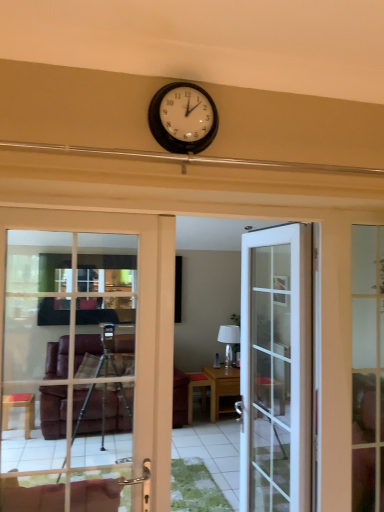
Question: From a real-world perspective, is wooden table at center, which appears as the first table when viewed from the left, located beneath white glossy lamp at center?

Choices:
 (A) yes
 (B) no

Answer: (A)

Question: Can you confirm if wooden table at center, which appears as the first table when viewed from the left, is smaller than white glossy lamp at center?

Choices:
 (A) no
 (B) yes

Answer: (A)

Question: Is wooden table at center, which appears as the first table when viewed from the left, outside of white glossy lamp at center?

Choices:
 (A) no
 (B) yes

Answer: (B)

Question: Does wooden table at center, placed as the second table when sorted from right to left, turn towards white glossy lamp at center?

Choices:
 (A) yes
 (B) no

Answer: (B)

Question: Can you confirm if wooden table at center, which appears as the first table when viewed from the left, is thinner than white glossy lamp at center?

Choices:
 (A) no
 (B) yes

Answer: (A)

Question: Considering the positions of point (13, 209) and point (213, 384), is point (13, 209) closer or farther from the camera than point (213, 384)?

Choices:
 (A) closer
 (B) farther

Answer: (A)

Question: Considering the positions of white glass door at left, acting as the 1th door starting from the front, and wooden table at center, the 1th table from the right, in the image, is white glass door at left, acting as the 1th door starting from the front, wider or thinner than wooden table at center, the 1th table from the right,?

Choices:
 (A) thin
 (B) wide

Answer: (A)

Question: From a real-world perspective, relative to wooden table at center, the 1th table from the right, is white glass door at left, which is the second door in back-to-front order, vertically above or below?

Choices:
 (A) below
 (B) above

Answer: (B)

Question: In terms of size, does white glass door at left, the second door positioned from the right, appear bigger or smaller than wooden table at center, the 1th table from the right?

Choices:
 (A) big
 (B) small

Answer: (B)

Question: Would you say white glossy lamp at center is to the left or to the right of wooden table at center, the 1th table from the right, in the picture?

Choices:
 (A) right
 (B) left

Answer: (A)

Question: From the image's perspective, relative to wooden table at center, positioned as the second table in left-to-right order, is white glossy lamp at center above or below?

Choices:
 (A) above
 (B) below

Answer: (A)

Question: From a real-world perspective, is white glossy lamp at center positioned above or below wooden table at center, positioned as the second table in left-to-right order?

Choices:
 (A) above
 (B) below

Answer: (A)

Question: Does point (230, 336) appear closer or farther from the camera than point (238, 385)?

Choices:
 (A) farther
 (B) closer

Answer: (A)

Question: Is matte black clock at upper center bigger or smaller than wooden table at center, the 1th table from the right?

Choices:
 (A) small
 (B) big

Answer: (A)

Question: Is point (157, 111) positioned closer to the camera than point (215, 406)?

Choices:
 (A) closer
 (B) farther

Answer: (A)